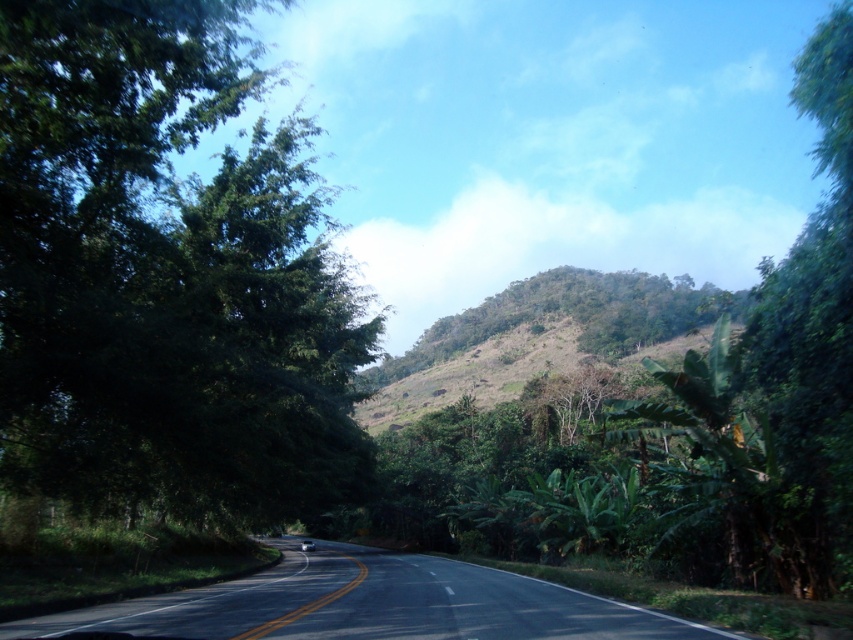
Question: Does green leafy tree at left appear under black asphalt road at center?

Choices:
 (A) yes
 (B) no

Answer: (B)

Question: Which point is closer to the camera taking this photo?

Choices:
 (A) (549, 589)
 (B) (132, 460)
 (C) (764, 424)
 (D) (514, 317)

Answer: (B)

Question: Observing the image, what is the correct spatial positioning of green leafy tree at right in reference to green grassy hillside at center?

Choices:
 (A) right
 (B) left

Answer: (B)

Question: Based on their relative distances, which object is farther from the green leafy tree at right?

Choices:
 (A) green grassy hillside at center
 (B) black asphalt road at center

Answer: (A)

Question: Does green leafy tree at left appear on the right side of black asphalt road at center?

Choices:
 (A) yes
 (B) no

Answer: (B)

Question: Which of these objects is positioned farthest from the green leafy tree at right?

Choices:
 (A) black asphalt road at center
 (B) green grassy hillside at center

Answer: (B)